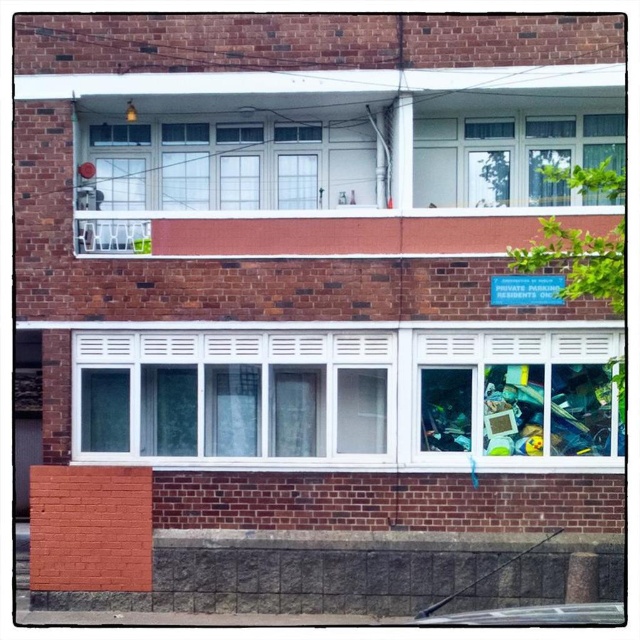
Question: Which point is closer to the camera taking this photo?

Choices:
 (A) (241, 436)
 (B) (502, 348)

Answer: (B)

Question: Can you confirm if white plastic window at center is bigger than transparent plastic window at center?

Choices:
 (A) yes
 (B) no

Answer: (A)

Question: Where is white plastic window at center located in relation to transparent plastic window at center in the image?

Choices:
 (A) right
 (B) left

Answer: (B)

Question: Can you confirm if white plastic window at center is positioned below transparent plastic window at center?

Choices:
 (A) yes
 (B) no

Answer: (A)